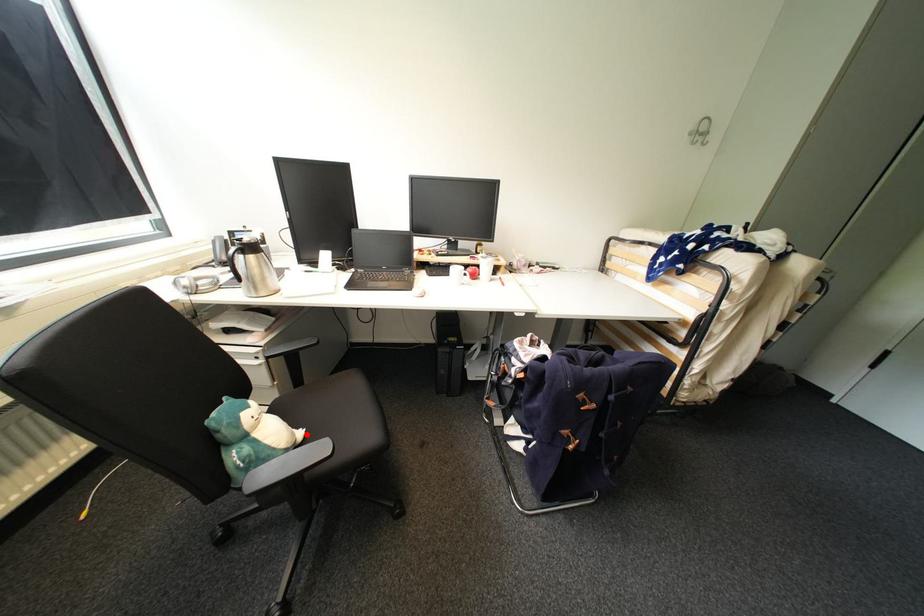
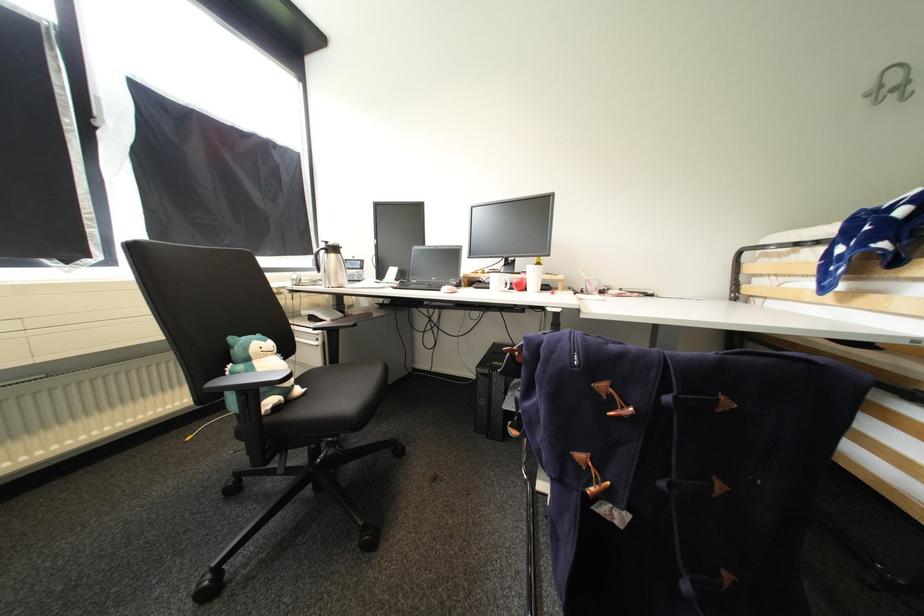
Question: I am providing you with two images of the same scene from different viewpoints. A red point is marked on the first image. Can you still see the location of the red point in image 2?

Choices:
 (A) Yes
 (B) No

Answer: (A)